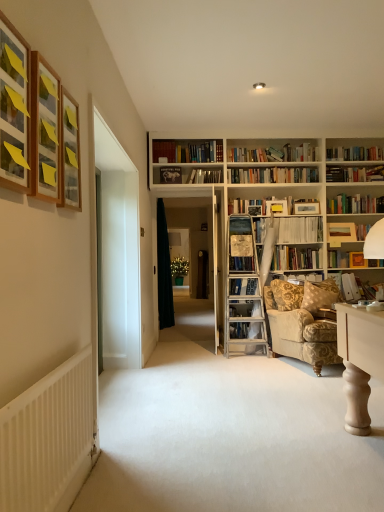
Question: Is hardcover book at upper center, the 5th book ordered from the bottom, bigger or smaller than white paper book at center, which is counted as the 4th book, starting from the bottom?

Choices:
 (A) small
 (B) big

Answer: (A)

Question: Is hardcover book at upper center, the 5th book ordered from the bottom, inside the boundaries of white paper book at center, arranged as the second book when viewed from the top, or outside?

Choices:
 (A) inside
 (B) outside

Answer: (B)

Question: Which is nearer to the hardcover book at upper right, arranged as the fifth book when viewed from the left?

Choices:
 (A) white ribbed radiator at lower left
 (B) hardcover book at upper center, which is the fifth book from right to left
 (C) transparent glass door at center
 (D) metallic silver picture frame at upper center, positioned as the first picture frame in right-to-left order
 (E) gold-patterned fabric armchair at lower right

Answer: (E)

Question: Considering the real-world distances, which object is closest to the white paper book at center-right, marked as the fifth book in a top-to-bottom arrangement?

Choices:
 (A) transparent glass door at center
 (B) wooden picture frame at upper left, the 4th picture frame when ordered from back to front
 (C) hardcover book at upper right, marked as the 1th book in a right-to-left arrangement
 (D) wooden framed picture at upper left, which is the third picture frame from front to back
 (E) black fabric curtain at center

Answer: (C)